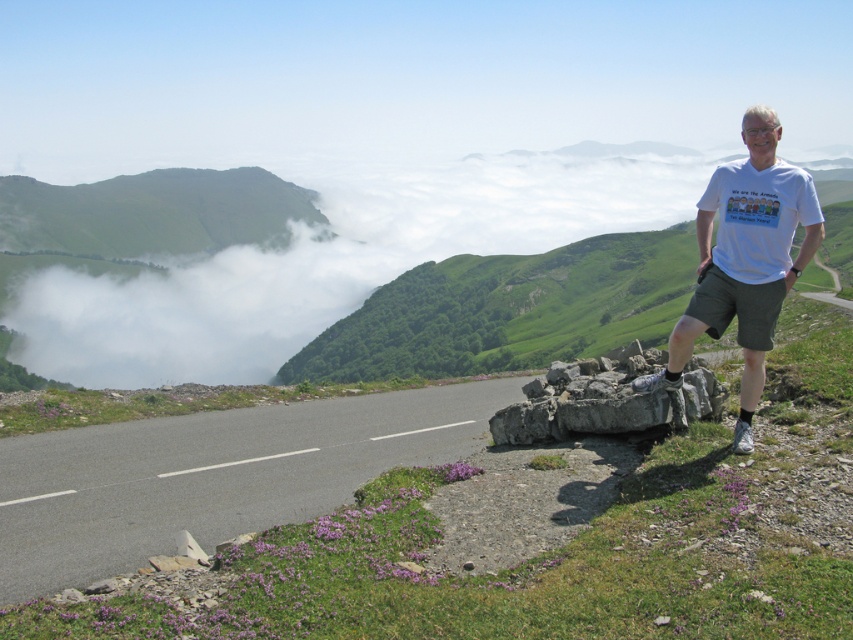
In the scene shown: Between white t-shirt at upper right and gray rough rock at right, which one appears on the left side from the viewer's perspective?

gray rough rock at right is more to the left.

Is white t-shirt at upper right shorter than gray rough rock at right?

No, white t-shirt at upper right is not shorter than gray rough rock at right.

Between point (779, 291) and point (601, 381), which one is positioned in front?

Point (779, 291) is more forward.

Identify the location of white t-shirt at upper right. This screenshot has height=640, width=853. (746, 260).

Does asphalt road at lower left appear under gray rough rock at right?

Correct, asphalt road at lower left is located below gray rough rock at right.

Which is in front, point (35, 515) or point (590, 384)?

Point (590, 384)

This screenshot has height=640, width=853. I want to click on asphalt road at lower left, so click(212, 476).

Between point (148, 502) and point (711, 227), which one is positioned in front?

Point (711, 227)

Between asphalt road at lower left and white t-shirt at upper right, which one is positioned lower?

asphalt road at lower left is lower down.

Who is more distant from viewer, (386, 451) or (735, 442)?

Point (386, 451)

The height and width of the screenshot is (640, 853). Find the location of `asphalt road at lower left`. asphalt road at lower left is located at coordinates (x=212, y=476).